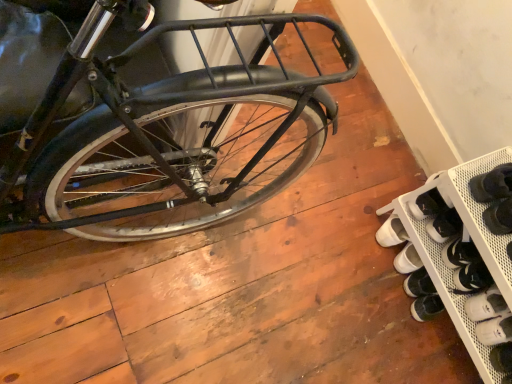
What do you see at coordinates (461, 249) in the screenshot? I see `white mesh shoe rack at lower right` at bounding box center [461, 249].

You are a GUI agent. You are given a task and a screenshot of the screen. Output one action in this format:
    pyautogui.click(x=<x>, y=<y>)
    Task: Click on the white mesh shoe rack at lower right
    
    Given the screenshot: What is the action you would take?
    pyautogui.click(x=461, y=249)

Describe the element at coordinates (495, 330) in the screenshot. I see `white matte shoe at lower right` at that location.

At what (x,y) coordinates should I click in order to perform the action: click on white matte shoe at lower right. Please return your answer as a coordinate pair (x, y). Image resolution: width=512 pixels, height=384 pixels. Looking at the image, I should click on (495, 330).

Where is `white mesh shoe rack at lower right`? The height and width of the screenshot is (384, 512). white mesh shoe rack at lower right is located at coordinates (461, 249).

In the scene shown: Considering the relative positions of white matte shoe at lower right and white mesh shoe rack at lower right in the image provided, is white matte shoe at lower right to the left or to the right of white mesh shoe rack at lower right?

In the image, white matte shoe at lower right appears on the right side of white mesh shoe rack at lower right.

Which object is closer to the camera taking this photo, white matte shoe at lower right or white mesh shoe rack at lower right?

white mesh shoe rack at lower right is more forward.

Does point (486, 333) lie behind point (425, 229)?

No, it is in front of (425, 229).

From the image's perspective, who appears lower, white matte shoe at lower right or white mesh shoe rack at lower right?

From the image's view, white matte shoe at lower right is below.

From a real-world perspective, is white matte shoe at lower right on white mesh shoe rack at lower right?

No.

Does white matte shoe at lower right have a greater width compared to white mesh shoe rack at lower right?

In fact, white matte shoe at lower right might be narrower than white mesh shoe rack at lower right.

In terms of height, does white matte shoe at lower right look taller or shorter compared to white mesh shoe rack at lower right?

In the image, white matte shoe at lower right appears to be shorter than white mesh shoe rack at lower right.

Does white matte shoe at lower right have a smaller size compared to white mesh shoe rack at lower right?

Correct, white matte shoe at lower right occupies less space than white mesh shoe rack at lower right.

Which is correct: white matte shoe at lower right is inside white mesh shoe rack at lower right, or outside of it?

The correct answer is: inside.

Is white matte shoe at lower right placed right next to white mesh shoe rack at lower right?

white matte shoe at lower right and white mesh shoe rack at lower right are not in contact.

Is white matte shoe at lower right positioned with its back to white mesh shoe rack at lower right?

Yes.

Find the location of a particular element. Image resolution: width=512 pixels, height=384 pixels. shelf that is in front of the white matte shoe at lower right is located at coordinates (461, 249).

Visually, is white mesh shoe rack at lower right positioned to the left or to the right of white matte shoe at lower right?

In the image, white mesh shoe rack at lower right appears on the left side of white matte shoe at lower right.

Is white mesh shoe rack at lower right in front of or behind white matte shoe at lower right in the image?

white mesh shoe rack at lower right is positioned closer to the viewer than white matte shoe at lower right.

Is point (507, 379) farther from camera compared to point (490, 333)?

No, it is in front of (490, 333).

From the image's perspective, which one is positioned higher, white mesh shoe rack at lower right or white matte shoe at lower right?

white mesh shoe rack at lower right.

From a real-world perspective, is white mesh shoe rack at lower right over white matte shoe at lower right?

Yes, from a real-world perspective, white mesh shoe rack at lower right is over white matte shoe at lower right

Is white mesh shoe rack at lower right thinner than white matte shoe at lower right?

Incorrect, the width of white mesh shoe rack at lower right is not less than that of white matte shoe at lower right.

Is white mesh shoe rack at lower right taller or shorter than white matte shoe at lower right?

white mesh shoe rack at lower right is taller than white matte shoe at lower right.

Considering the relative sizes of white mesh shoe rack at lower right and white matte shoe at lower right in the image provided, is white mesh shoe rack at lower right smaller than white matte shoe at lower right?

Actually, white mesh shoe rack at lower right might be larger than white matte shoe at lower right.

Is white mesh shoe rack at lower right located outside white matte shoe at lower right?

Absolutely, white mesh shoe rack at lower right is external to white matte shoe at lower right.

Is white mesh shoe rack at lower right in contact with white matte shoe at lower right?

No, white mesh shoe rack at lower right is not in contact with white matte shoe at lower right.

Is white mesh shoe rack at lower right looking in the opposite direction of white matte shoe at lower right?

Yes, white mesh shoe rack at lower right is facing away from white matte shoe at lower right.

What's the angular difference between white mesh shoe rack at lower right and white matte shoe at lower right's facing directions?

The facing directions of white mesh shoe rack at lower right and white matte shoe at lower right are 3.63 degrees apart.

How much distance is there between white mesh shoe rack at lower right and white matte shoe at lower right?

white mesh shoe rack at lower right is 10.34 inches away from white matte shoe at lower right.

Where is `shoe lying behind the white mesh shoe rack at lower right`? The height and width of the screenshot is (384, 512). shoe lying behind the white mesh shoe rack at lower right is located at coordinates (495, 330).

Identify the location of shoe lying on the right of white mesh shoe rack at lower right. The image size is (512, 384). (495, 330).

At what (x,y) coordinates should I click in order to perform the action: click on shoe behind the white mesh shoe rack at lower right. Please return your answer as a coordinate pair (x, y). This screenshot has width=512, height=384. Looking at the image, I should click on (495, 330).